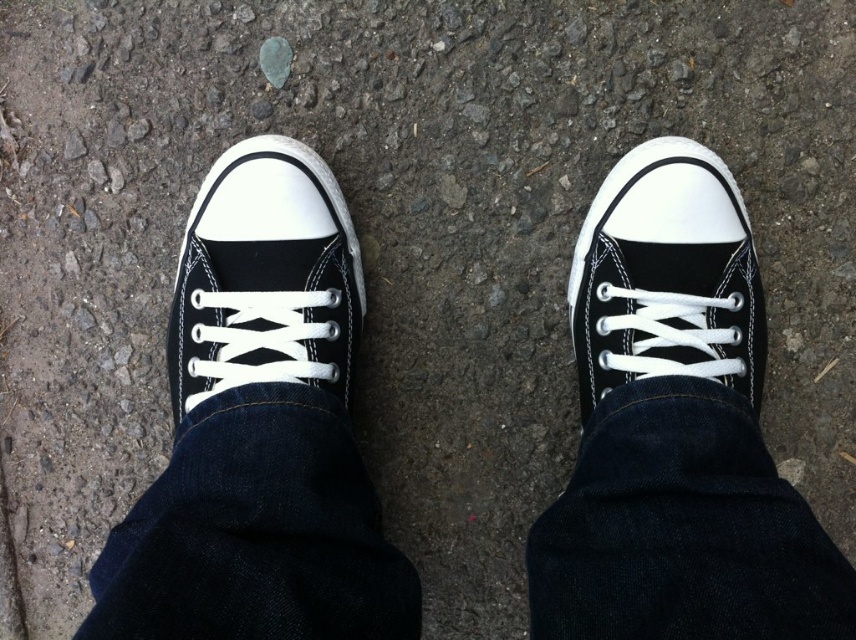
You are trying to take a photo of both black canvas shoes. Since the black canvas shoe at left is covering part of the black canvas shoe at right, can you adjust your camera angle to capture both fully without moving the shoes?

The black canvas shoe at left is positioned over the black canvas shoe at right, so adjusting the camera angle to a lower or higher perspective might allow capturing both fully without moving them.

You are standing in a park and see the point marked as point [324,360]. If you take a step forward, will you step on that point?

The point [324,360] is 3.32 feet away from the viewer. Since a typical step is about 2.5 to 3 feet, stepping forward would likely land you near or past the point depending on stride length, but not exactly on it unless adjusted precisely.